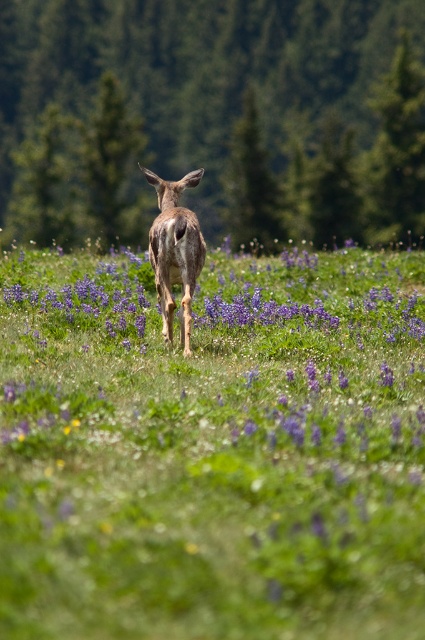
You are a photographer standing in the green grassy field at center and want to take a picture of the shiny brown deer at center. Since the deer is moving away from you, which direction should you move to keep it in frame?

The green grassy field at center is positioned on the right side of the shiny brown deer at center, so you should move to the right to keep the deer in frame as it moves away.

Looking at this image, you are a photographer aiming to capture the deer in the center of the image. You notice two points marked in the scene. The first point is at coordinate point (28, 310) and the second is at coordinate point (181, 234). Which point is closer to your camera lens?

Point (28, 310) is further to the camera than point (181, 234), so the point closer to the camera lens is point (181, 234).